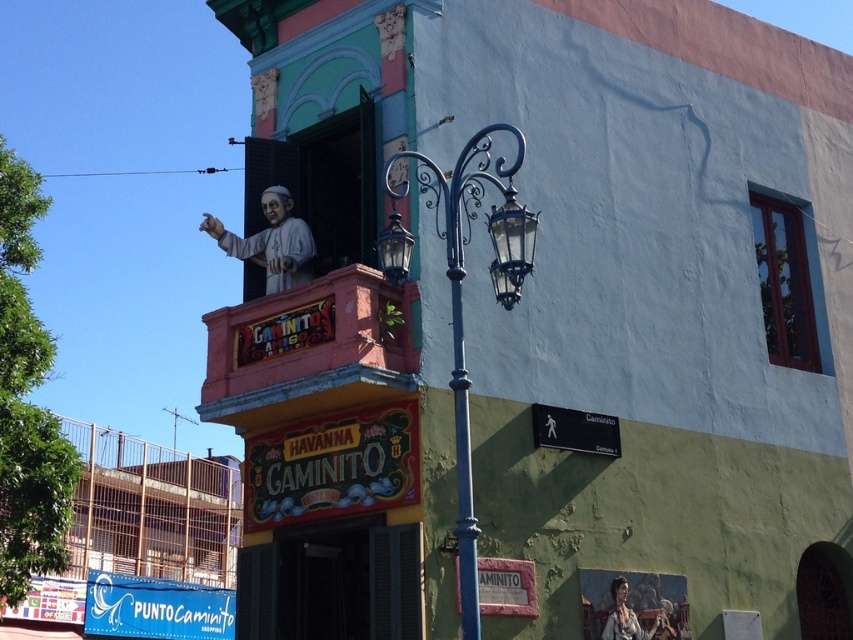
Question: Which point appears farthest from the camera in this image?

Choices:
 (A) (625, 584)
 (B) (392, 278)
 (C) (468, 422)

Answer: (A)

Question: Is polished metal streetlamp at center behind matte black lamp at upper center?

Choices:
 (A) yes
 (B) no

Answer: (B)

Question: Is wooden frame window at upper right to the right of matte brown fabric at lower right from the viewer's perspective?

Choices:
 (A) yes
 (B) no

Answer: (A)

Question: Which of the following is the farthest from the observer?

Choices:
 (A) (451, 275)
 (B) (396, 236)

Answer: (B)

Question: Which object is the farthest from the wooden painted balcony at upper center?

Choices:
 (A) matte brown fabric at lower right
 (B) matte black lamp at upper center
 (C) wooden frame window at upper right

Answer: (C)

Question: Is polished metal streetlamp at center above matte brown fabric at lower right?

Choices:
 (A) no
 (B) yes

Answer: (B)